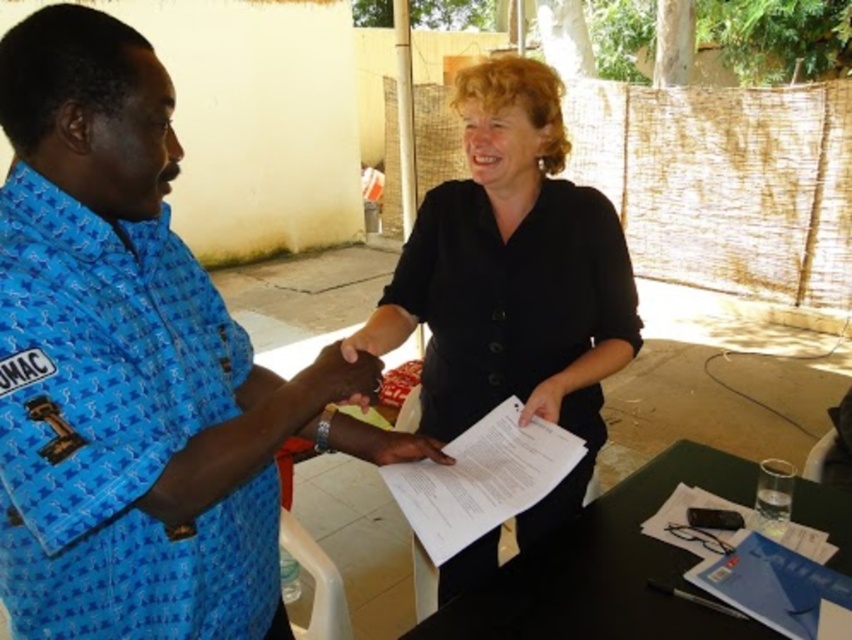
You are a photographer at the scene and want to capture a photo where both the blue printed shirt at center and the white paper at center are clearly visible. Considering their sizes, which object should you focus on first to ensure both are in frame?

The blue printed shirt at center is taller than the white paper at center, so focusing on the blue printed shirt at center first will help ensure both objects are in frame since it occupies more vertical space.

You are a photographer taking a picture of the blue printed shirt at center and the white paper at center. Which object will appear larger in the photo?

The blue printed shirt at center will appear larger in the photo because it is bigger than the white paper at center according to the description.